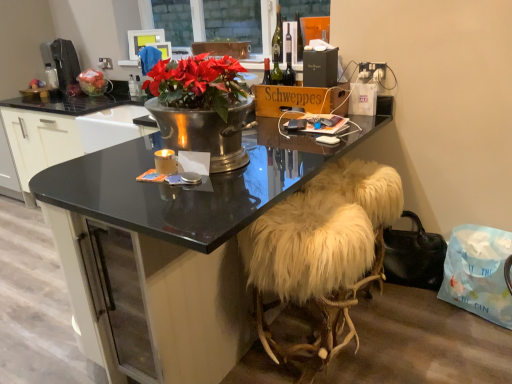
I want to click on vacant region to the left of black leather handbag at lower right, so click(422, 315).